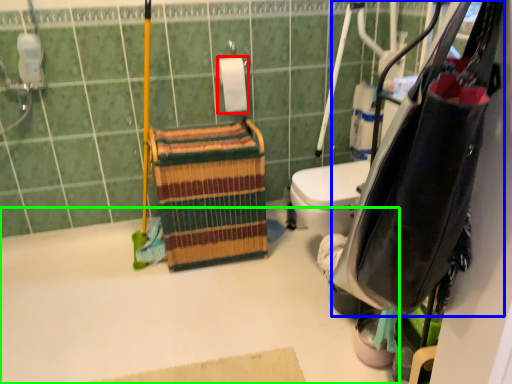
Question: Estimate the real-world distances between objects in this image. Which object is farther from toilet paper (highlighted by a red box), bag (highlighted by a blue box) or bath (highlighted by a green box)?

Choices:
 (A) bag
 (B) bath

Answer: (A)